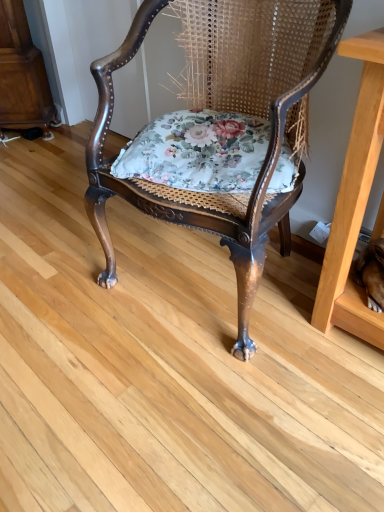
Question: Is floral fabric cushion at center inside the boundaries of polished wood chair at center, or outside?

Choices:
 (A) outside
 (B) inside

Answer: (B)

Question: From a real-world perspective, is floral fabric cushion at center positioned above or below polished wood chair at center?

Choices:
 (A) above
 (B) below

Answer: (A)

Question: In the image, is floral fabric cushion at center positioned in front of or behind polished wood chair at center?

Choices:
 (A) behind
 (B) front

Answer: (A)

Question: Based on their positions, is polished wood chair at center located to the left or right of floral fabric cushion at center?

Choices:
 (A) left
 (B) right

Answer: (B)

Question: Is polished wood chair at center in front of or behind floral fabric cushion at center in the image?

Choices:
 (A) behind
 (B) front

Answer: (B)

Question: Considering the positions of polished wood chair at center and floral fabric cushion at center in the image, is polished wood chair at center wider or thinner than floral fabric cushion at center?

Choices:
 (A) wide
 (B) thin

Answer: (A)

Question: Is polished wood chair at center taller or shorter than floral fabric cushion at center?

Choices:
 (A) short
 (B) tall

Answer: (B)